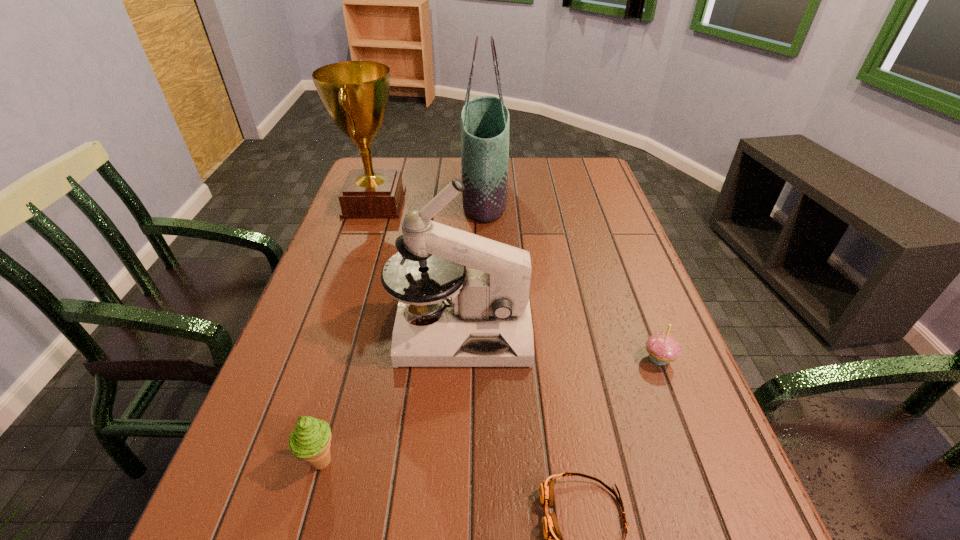
This screenshot has width=960, height=540. In order to click on vacant area at the far right corner in this screenshot , I will do `click(598, 175)`.

Identify the location of vacant space that is in between the cupcake and the tote bag. The height and width of the screenshot is (540, 960). (571, 277).

Locate an element on the screen. The width and height of the screenshot is (960, 540). free area in between the fifth tallest object and the microscope is located at coordinates (560, 345).

Identify the location of the closest object to the tallest object. The image size is (960, 540). (355, 93).

Select which object appears as the second closest to the shortest object. Please provide its 2D coordinates. Your answer should be formatted as a tuple, i.e. [(x, y)], where the tuple contains the x and y coordinates of a point satisfying the conditions above.

[(662, 348)]

The height and width of the screenshot is (540, 960). What are the coordinates of `free space that satisfies the following two spatial constraints: 1. on the back side of the tallest object; 2. on the right side of the icecream` in the screenshot? It's located at (395, 195).

Locate an element on the screen. The image size is (960, 540). free space that satisfies the following two spatial constraints: 1. at the eyepiece of the fifth tallest object; 2. on the left side of the microscope is located at coordinates (459, 359).

Locate an element on the screen. free space that satisfies the following two spatial constraints: 1. at the eyepiece of the microscope; 2. on the left side of the cupcake is located at coordinates (459, 359).

At what (x,y) coordinates should I click in order to perform the action: click on free space that satisfies the following two spatial constraints: 1. at the eyepiece of the fifth tallest object; 2. on the right side of the microscope. Please return your answer as a coordinate pair (x, y). The image size is (960, 540). Looking at the image, I should click on (459, 359).

I want to click on vacant region that satisfies the following two spatial constraints: 1. on the plaque of the second shortest object; 2. on the right side of the award, so click(322, 359).